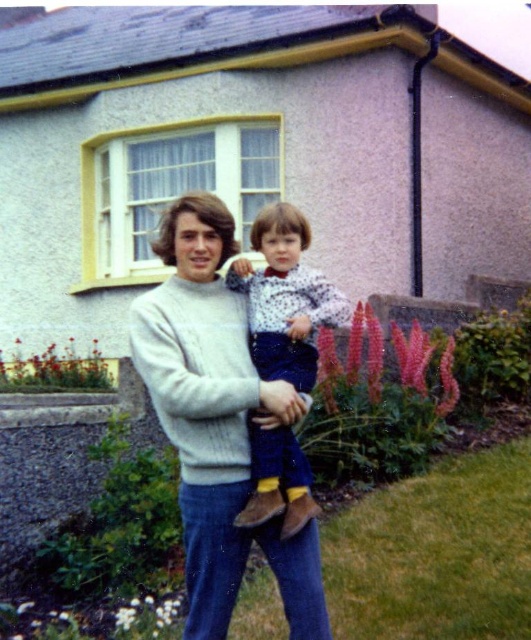
You are a tailor who needs to determine which item has a greater thickness between the knitted sweater at center and the pink fluffy flowers at lower left. Based on the scene, which one would you choose?

The pink fluffy flowers at lower left are thicker than the knitted sweater at center, so you should choose the pink fluffy flowers at lower left as the thicker item.

Looking at this image, you are standing in front of the house and want to place a small decoration between the pink fluffy flowers at lower left and the white matte flower at lower center. Which flower should you place the decoration closer to if you want it to be in front of both?

You should place the decoration closer to the pink fluffy flowers at lower left because the white matte flower at lower center is behind them, so the pink fluffy flowers are in front.

You are standing at the point labeled point (73, 353) and want to walk towards the house. Is the point labeled point (290, 557) between you and the house?

Yes, point (290, 557) is between you and the house because it is in front of point (73, 353), which is your current position.